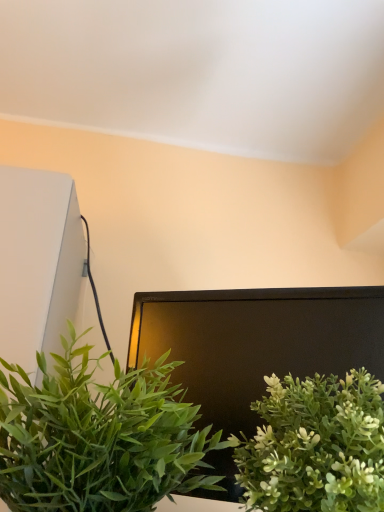
Question: From the image's perspective, is green matte plant at lower right, the first houseplant viewed from the right, above or below green leafy plant at center, the 2th houseplant when ordered from right to left?

Choices:
 (A) below
 (B) above

Answer: (A)

Question: In terms of size, does green matte plant at lower right, positioned as the second houseplant in left-to-right order, appear bigger or smaller than green leafy plant at center, the 2th houseplant when ordered from right to left?

Choices:
 (A) small
 (B) big

Answer: (A)

Question: Considering the positions of green matte plant at lower right, the first houseplant viewed from the right, and green leafy plant at center, the first houseplant in the left-to-right sequence, in the image, is green matte plant at lower right, the first houseplant viewed from the right, wider or thinner than green leafy plant at center, the first houseplant in the left-to-right sequence,?

Choices:
 (A) thin
 (B) wide

Answer: (B)

Question: In terms of height, does green leafy plant at center, the 2th houseplant when ordered from right to left, look taller or shorter compared to green matte plant at lower right, the first houseplant viewed from the right?

Choices:
 (A) tall
 (B) short

Answer: (A)

Question: Considering the positions of green leafy plant at center, the 2th houseplant when ordered from right to left, and green matte plant at lower right, positioned as the second houseplant in left-to-right order, in the image, is green leafy plant at center, the 2th houseplant when ordered from right to left, bigger or smaller than green matte plant at lower right, positioned as the second houseplant in left-to-right order,?

Choices:
 (A) big
 (B) small

Answer: (A)

Question: Is green leafy plant at center, the 2th houseplant when ordered from right to left, situated inside green matte plant at lower right, positioned as the second houseplant in left-to-right order, or outside?

Choices:
 (A) inside
 (B) outside

Answer: (B)

Question: Does point (139, 472) appear closer or farther from the camera than point (349, 475)?

Choices:
 (A) closer
 (B) farther

Answer: (B)